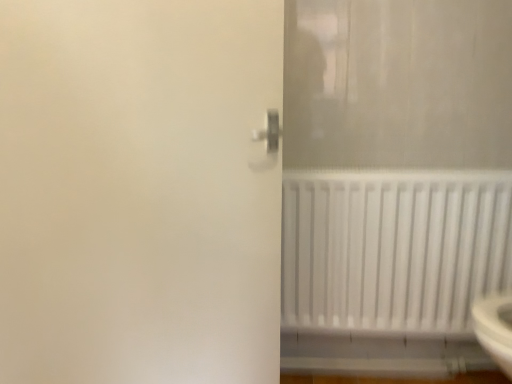
Question: Is white matte radiator at lower right aimed at white matte screen door at center?

Choices:
 (A) no
 (B) yes

Answer: (A)

Question: Can you confirm if white matte radiator at lower right is wider than white matte screen door at center?

Choices:
 (A) no
 (B) yes

Answer: (B)

Question: Is white matte radiator at lower right not inside white matte screen door at center?

Choices:
 (A) no
 (B) yes

Answer: (B)

Question: Is the surface of white matte radiator at lower right in direct contact with white matte screen door at center?

Choices:
 (A) yes
 (B) no

Answer: (B)

Question: Can white matte screen door at center be found inside white matte radiator at lower right?

Choices:
 (A) yes
 (B) no

Answer: (B)

Question: From a real-world perspective, is white matte radiator at lower right over white matte screen door at center?

Choices:
 (A) no
 (B) yes

Answer: (A)

Question: From the image's perspective, is white matte screen door at center above white matte radiator at lower right?

Choices:
 (A) yes
 (B) no

Answer: (A)

Question: Does white matte screen door at center come behind white matte radiator at lower right?

Choices:
 (A) yes
 (B) no

Answer: (B)

Question: Considering the relative sizes of white matte screen door at center and white matte radiator at lower right in the image provided, is white matte screen door at center taller than white matte radiator at lower right?

Choices:
 (A) yes
 (B) no

Answer: (A)

Question: Does white matte screen door at center turn towards white matte radiator at lower right?

Choices:
 (A) yes
 (B) no

Answer: (B)

Question: From the image's perspective, is white matte screen door at center beneath white matte radiator at lower right?

Choices:
 (A) yes
 (B) no

Answer: (B)

Question: Does white matte screen door at center touch white matte radiator at lower right?

Choices:
 (A) no
 (B) yes

Answer: (A)

Question: In terms of width, does white matte screen door at center look wider or thinner when compared to white matte radiator at lower right?

Choices:
 (A) thin
 (B) wide

Answer: (A)